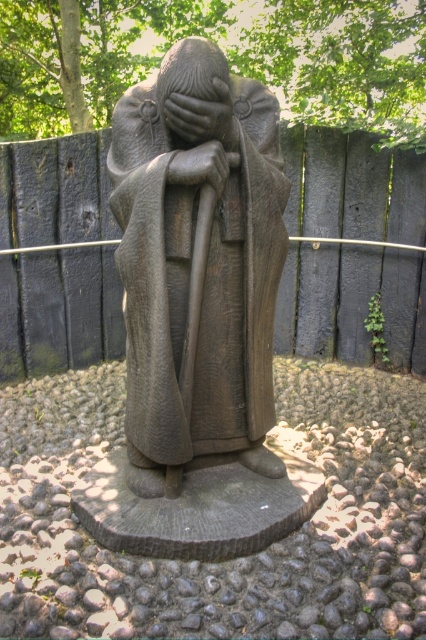
Who is shorter, bronze statue at center or smooth stone hand at center?

With less height is smooth stone hand at center.

Is bronze statue at center wider than smooth stone hand at center?

Yes.

Find the location of `bronze statue at center`. bronze statue at center is located at coordinates (198, 272).

Is black wood fence at center positioned in front of smooth stone hand at center?

No.

Can you confirm if black wood fence at center is positioned to the left of smooth stone hand at center?

Result: In fact, black wood fence at center is to the right of smooth stone hand at center.

Who is more forward, (333, 136) or (232, 163)?

Point (232, 163) is in front.

Identify the location of black wood fence at center. (58, 310).

Does black wood fence at center have a lesser width compared to dark gray stone hand at center?

Incorrect, black wood fence at center's width is not less than dark gray stone hand at center's.

Can you confirm if black wood fence at center is positioned above dark gray stone hand at center?

No.

The image size is (426, 640). What do you see at coordinates (58, 310) in the screenshot?
I see `black wood fence at center` at bounding box center [58, 310].

Locate an element on the screen. black wood fence at center is located at coordinates (58, 310).